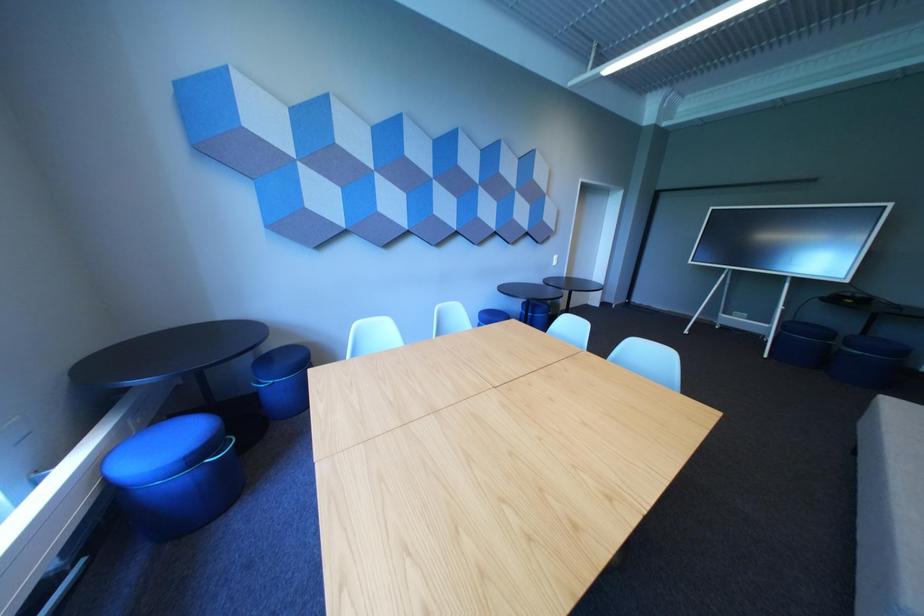
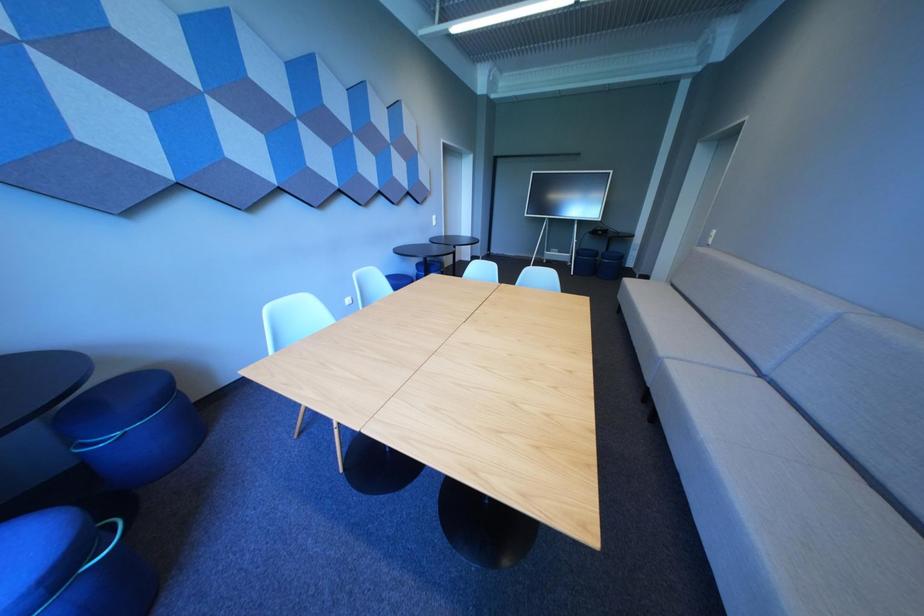
Question: The images are taken continuously from a first-person perspective. In which direction is your viewpoint rotating?

Choices:
 (A) Left
 (B) Right
 (C) Up
 (D) Down

Answer: (B)